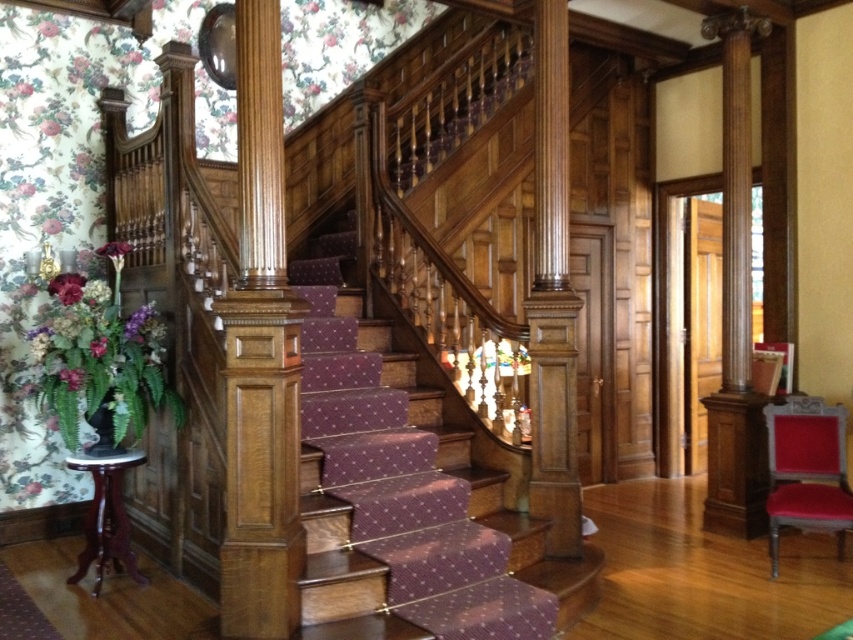
The image size is (853, 640). Find the location of `purple carpeted stairs at center`. purple carpeted stairs at center is located at coordinates (405, 493).

Between polished wood pillar at center and velvet red armchair at lower right, which one is positioned higher?

Positioned higher is polished wood pillar at center.

Can you confirm if polished wood pillar at center is positioned above velvet red armchair at lower right?

Correct, polished wood pillar at center is located above velvet red armchair at lower right.

Does point (538, 198) lie in front of point (844, 490)?

Yes, it is in front of point (844, 490).

Locate an element on the screen. polished wood pillar at center is located at coordinates (552, 296).

Does point (254, 385) come closer to viewer compared to point (564, 522)?

Yes, it is.

I want to click on polished oak pillar at center, so click(x=260, y=358).